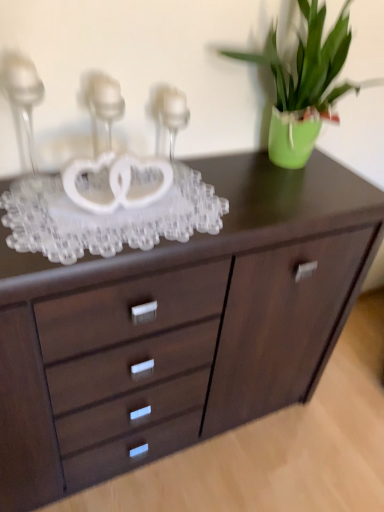
Question: Can you confirm if clear glass candle holder at upper left, positioned as the third candle holder in right-to-left order, is bigger than dark wood chest of drawers at center?

Choices:
 (A) yes
 (B) no

Answer: (B)

Question: Is the position of clear glass candle holder at upper left, acting as the first candle holder starting from the left, less distant than that of dark wood chest of drawers at center?

Choices:
 (A) no
 (B) yes

Answer: (B)

Question: Does clear glass candle holder at upper left, acting as the first candle holder starting from the left, appear on the right side of dark wood chest of drawers at center?

Choices:
 (A) no
 (B) yes

Answer: (A)

Question: From the image's perspective, is clear glass candle holder at upper left, positioned as the third candle holder in right-to-left order, located above dark wood chest of drawers at center?

Choices:
 (A) no
 (B) yes

Answer: (B)

Question: Is the position of clear glass candle holder at upper left, acting as the first candle holder starting from the left, more distant than that of dark wood chest of drawers at center?

Choices:
 (A) yes
 (B) no

Answer: (B)

Question: Can you confirm if clear glass candle holder at upper left, acting as the first candle holder starting from the left, is shorter than dark wood chest of drawers at center?

Choices:
 (A) no
 (B) yes

Answer: (A)

Question: From a real-world perspective, is clear glass candle holder at upper left, positioned as the third candle holder in right-to-left order, physically above clear glass candle holder at upper left, the 2th candle holder positioned from the left?

Choices:
 (A) yes
 (B) no

Answer: (A)

Question: Is clear glass candle holder at upper left, acting as the first candle holder starting from the left, shorter than clear glass candle holder at upper left, acting as the 2th candle holder starting from the right?

Choices:
 (A) no
 (B) yes

Answer: (A)

Question: Is clear glass candle holder at upper left, positioned as the third candle holder in right-to-left order, looking in the opposite direction of clear glass candle holder at upper left, acting as the 2th candle holder starting from the right?

Choices:
 (A) no
 (B) yes

Answer: (A)

Question: Considering the relative positions of clear glass candle holder at upper left, acting as the first candle holder starting from the left, and clear glass candle holder at upper left, the 2th candle holder positioned from the left, in the image provided, is clear glass candle holder at upper left, acting as the first candle holder starting from the left, in front of clear glass candle holder at upper left, the 2th candle holder positioned from the left,?

Choices:
 (A) yes
 (B) no

Answer: (A)

Question: Are clear glass candle holder at upper left, positioned as the third candle holder in right-to-left order, and clear glass candle holder at upper left, acting as the 2th candle holder starting from the right, located far from each other?

Choices:
 (A) yes
 (B) no

Answer: (B)

Question: Does clear glass candle holder at upper left, positioned as the third candle holder in right-to-left order, appear on the left side of clear glass candle holder at upper left, acting as the 2th candle holder starting from the right?

Choices:
 (A) yes
 (B) no

Answer: (A)

Question: Does clear glass candle holder at upper left, acting as the first candle holder starting from the left, have a larger size compared to green matte vase at upper right?

Choices:
 (A) no
 (B) yes

Answer: (A)